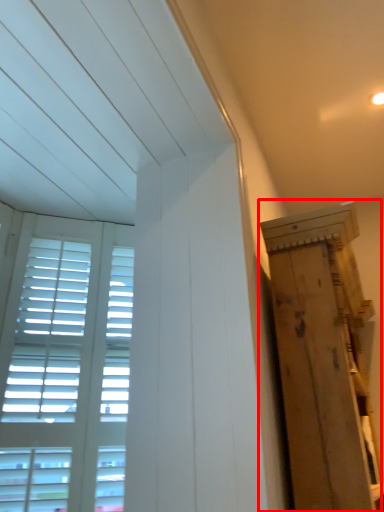
Question: Considering the relative positions of plywood (annotated by the red box) and window in the image provided, where is plywood (annotated by the red box) located with respect to the staircase?

Choices:
 (A) left
 (B) right

Answer: (B)